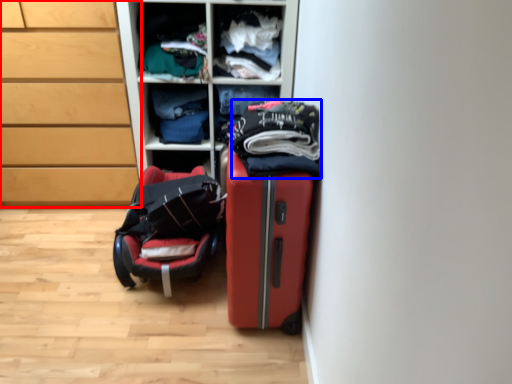
Question: Which object is further to the camera taking this photo, chest of drawers (highlighted by a red box) or clothing (highlighted by a blue box)?

Choices:
 (A) chest of drawers
 (B) clothing

Answer: (A)